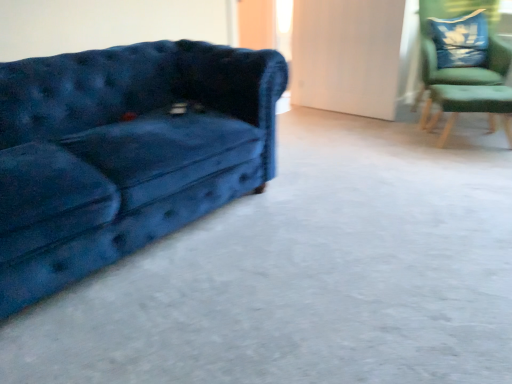
What do you see at coordinates (307, 274) in the screenshot?
I see `blue velvet couch at left` at bounding box center [307, 274].

What is the approximate width of green fabric side table at right?

It is 14.07 inches.

This screenshot has width=512, height=384. I want to click on velvet blue pillow at upper right, so click(460, 40).

What do you see at coordinates (460, 40) in the screenshot? I see `velvet blue pillow at upper right` at bounding box center [460, 40].

The height and width of the screenshot is (384, 512). I want to click on blue velvet couch at left, so [x=307, y=274].

Between velvet blue couch at left and green fabric chair at upper right, which one has smaller width?

green fabric chair at upper right.

Can you tell me how much velvet blue couch at left and green fabric chair at upper right differ in facing direction?

They differ by 53.7 degrees in their facing directions.

Between velvet blue couch at left and green fabric chair at upper right, which one is positioned behind?

green fabric chair at upper right is further from the camera.

From the picture: From the image's perspective, who appears lower, velvet blue couch at left or green fabric chair at upper right?

velvet blue couch at left is shown below in the image.

From the image's perspective, is green fabric side table at right positioned above or below blue velvet couch at left?

Clearly, from the image's perspective, green fabric side table at right is above blue velvet couch at left.

Could you tell me if green fabric side table at right is facing blue velvet couch at left?

No, green fabric side table at right is not facing towards blue velvet couch at left.

From a real-world perspective, is green fabric side table at right above or below blue velvet couch at left?

From a real-world perspective, green fabric side table at right is physically above blue velvet couch at left.

Is point (467, 53) less distant than point (268, 264)?

No, it is behind (268, 264).

From the image's perspective, which object appears higher, velvet blue pillow at upper right or blue velvet couch at left?

velvet blue pillow at upper right is shown above in the image.

From a real-world perspective, which is physically above, velvet blue pillow at upper right or blue velvet couch at left?

From a 3D spatial view, velvet blue pillow at upper right is above.

Is velvet blue pillow at upper right placed right next to blue velvet couch at left?

velvet blue pillow at upper right is not next to blue velvet couch at left, and they're not touching.

Is blue velvet couch at left spatially inside green fabric chair at upper right, or outside of it?

blue velvet couch at left lies outside green fabric chair at upper right.

Could you tell me if blue velvet couch at left is facing green fabric chair at upper right?

No, blue velvet couch at left is not oriented towards green fabric chair at upper right.

Consider the image. Considering the positions of objects blue velvet couch at left and green fabric chair at upper right in the image provided, who is more to the right, blue velvet couch at left or green fabric chair at upper right?

Positioned to the right is green fabric chair at upper right.

Looking at the image, does velvet blue couch at left seem bigger or smaller compared to blue velvet couch at left?

Considering their sizes, velvet blue couch at left takes up more space than blue velvet couch at left.

Which is less distant, (131, 104) or (186, 369)?

Point (131, 104).

Is there a large distance between velvet blue pillow at upper right and green fabric chair at upper right?

No, velvet blue pillow at upper right is in close proximity to green fabric chair at upper right.

Which object is positioned more to the right, velvet blue pillow at upper right or green fabric chair at upper right?

green fabric chair at upper right is more to the right.

Considering the relative sizes of velvet blue pillow at upper right and green fabric chair at upper right in the image provided, is velvet blue pillow at upper right smaller than green fabric chair at upper right?

Yes, velvet blue pillow at upper right is smaller than green fabric chair at upper right.

Considering the positions of point (452, 57) and point (435, 51), is point (452, 57) closer or farther from the camera than point (435, 51)?

Point (452, 57) appears to be farther away from the viewer than point (435, 51).

Between velvet blue couch at left and green fabric side table at right, which one has more height?

With more height is velvet blue couch at left.

From a real-world perspective, is velvet blue couch at left positioned above or below green fabric side table at right?

From a real-world perspective, velvet blue couch at left is physically above green fabric side table at right.

Is velvet blue couch at left in contact with green fabric side table at right?

No, velvet blue couch at left is not with green fabric side table at right.

Considering the positions of objects velvet blue couch at left and green fabric side table at right in the image provided, who is more to the left, velvet blue couch at left or green fabric side table at right?

Positioned to the left is velvet blue couch at left.

Where is `chair that appears above the velvet blue couch at left (from a real-world perspective)`? The height and width of the screenshot is (384, 512). chair that appears above the velvet blue couch at left (from a real-world perspective) is located at coordinates (466, 66).

The height and width of the screenshot is (384, 512). I want to click on side table to the right of blue velvet couch at left, so click(469, 106).

Considering their positions, is velvet blue couch at left positioned closer to green fabric chair at upper right than blue velvet couch at left?

blue velvet couch at left is positioned closer to the anchor green fabric chair at upper right.

Estimate the real-world distances between objects in this image. Which object is further from velvet blue couch at left, blue velvet couch at left or velvet blue pillow at upper right?

velvet blue pillow at upper right.

Considering their positions, is blue velvet couch at left positioned further to velvet blue couch at left than green fabric side table at right?

The object further to velvet blue couch at left is green fabric side table at right.

From the image, which object appears to be nearer to green fabric chair at upper right, velvet blue couch at left or green fabric side table at right?

Based on the image, green fabric side table at right appears to be nearer to green fabric chair at upper right.

When comparing their distances from green fabric chair at upper right, does velvet blue couch at left or velvet blue pillow at upper right seem further?

velvet blue couch at left lies further to green fabric chair at upper right than the other object.

Looking at the image, which one is located further to velvet blue pillow at upper right, velvet blue couch at left or green fabric side table at right?

velvet blue couch at left.

From the image, which object appears to be farther from velvet blue pillow at upper right, velvet blue couch at left or green fabric chair at upper right?

velvet blue couch at left is positioned further to the anchor velvet blue pillow at upper right.

When comparing their distances from velvet blue couch at left, does green fabric chair at upper right or velvet blue pillow at upper right seem further?

velvet blue pillow at upper right.

Locate an element on the screen. This screenshot has width=512, height=384. side table located between blue velvet couch at left and green fabric chair at upper right in the depth direction is located at coordinates (469, 106).

I want to click on side table located between velvet blue couch at left and velvet blue pillow at upper right in the left-right direction, so click(x=469, y=106).

This screenshot has width=512, height=384. Find the location of `chair between blue velvet couch at left and velvet blue pillow at upper right along the z-axis`. chair between blue velvet couch at left and velvet blue pillow at upper right along the z-axis is located at coordinates (466, 66).

This screenshot has height=384, width=512. In order to click on studio couch positioned between blue velvet couch at left and green fabric chair at upper right from near to far in this screenshot , I will do `click(124, 152)`.